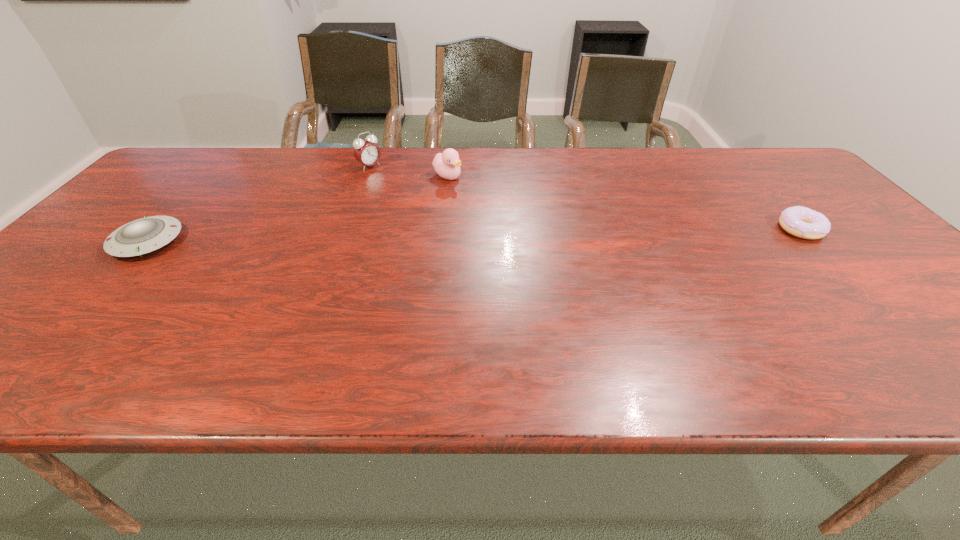
This screenshot has width=960, height=540. Find the location of `vacant space located 0.120m on the clock face of the alarm clock`. vacant space located 0.120m on the clock face of the alarm clock is located at coordinates tap(396, 187).

Locate an element on the screen. The width and height of the screenshot is (960, 540). vacant position located 0.260m on the clock face of the alarm clock is located at coordinates (422, 207).

Image resolution: width=960 pixels, height=540 pixels. Find the location of `vacant region located 0.300m on the clock face of the alarm clock`. vacant region located 0.300m on the clock face of the alarm clock is located at coordinates (431, 213).

You are a GUI agent. You are given a task and a screenshot of the screen. Output one action in this format:
    pyautogui.click(x=<x>, y=<y>)
    Task: Click on the duckling present at the far edge
    Image resolution: width=960 pixels, height=540 pixels.
    Given the screenshot: What is the action you would take?
    pyautogui.click(x=447, y=165)

Locate an element on the screen. This screenshot has height=540, width=960. alarm clock that is at the far edge is located at coordinates (366, 152).

The height and width of the screenshot is (540, 960). I want to click on object that is positioned at the left edge, so click(145, 235).

What are the coordinates of `object present at the right edge` in the screenshot? It's located at (799, 221).

At what (x,y) coordinates should I click in order to perform the action: click on blank area at the far edge. Please return your answer as a coordinate pair (x, y). The height and width of the screenshot is (540, 960). Looking at the image, I should click on (439, 152).

You are a GUI agent. You are given a task and a screenshot of the screen. Output one action in this format:
    pyautogui.click(x=<x>, y=<y>)
    Task: Click on the vacant area at the near edge of the desktop
    The width and height of the screenshot is (960, 540).
    Given the screenshot: What is the action you would take?
    pyautogui.click(x=756, y=328)

Locate an element on the screen. Image resolution: width=960 pixels, height=540 pixels. vacant space at the left edge of the desktop is located at coordinates (111, 215).